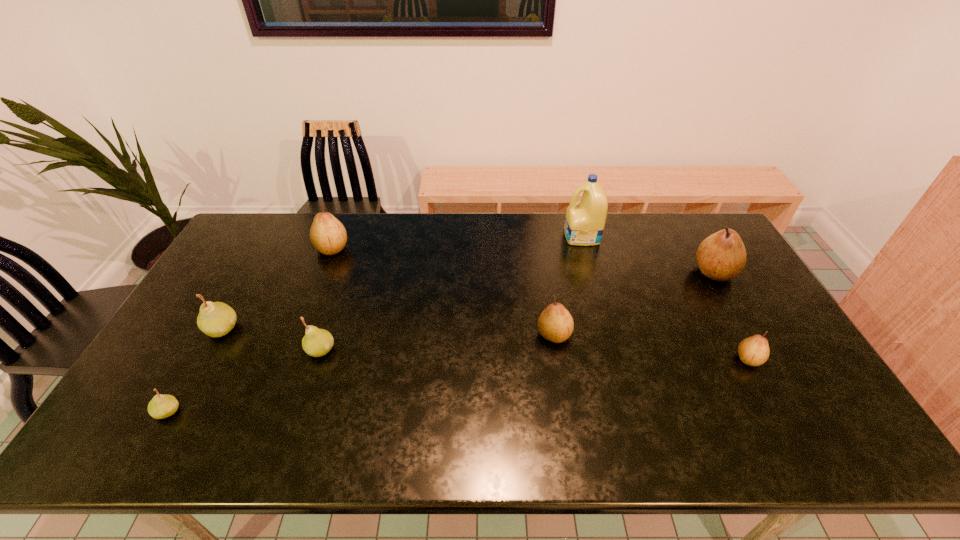
Locate an element on the screen. free space located on the right of the nearest object is located at coordinates (315, 412).

What are the coordinates of `free space located on the back of the smallest brown pear` in the screenshot? It's located at (697, 265).

Locate an element on the screen. The image size is (960, 540). detergent at the far edge is located at coordinates (584, 223).

I want to click on pear at the far edge, so click(327, 234).

At what (x,y) coordinates should I click in order to perform the action: click on object that is at the near edge. Please return your answer as a coordinate pair (x, y). This screenshot has height=540, width=960. Looking at the image, I should click on (161, 406).

Identify the location of object present at the near left corner. The image size is (960, 540). (161, 406).

Locate an element on the screen. The width and height of the screenshot is (960, 540). free space at the far edge of the desktop is located at coordinates (468, 243).

Image resolution: width=960 pixels, height=540 pixels. In the image, there is a desktop. Identify the location of vacant space at the near edge. (598, 433).

This screenshot has width=960, height=540. In the image, there is a desktop. In order to click on vacant space at the left edge in this screenshot , I will do `click(180, 394)`.

Find the location of a particular element. Image resolution: width=960 pixels, height=540 pixels. vacant area at the right edge of the desktop is located at coordinates (729, 295).